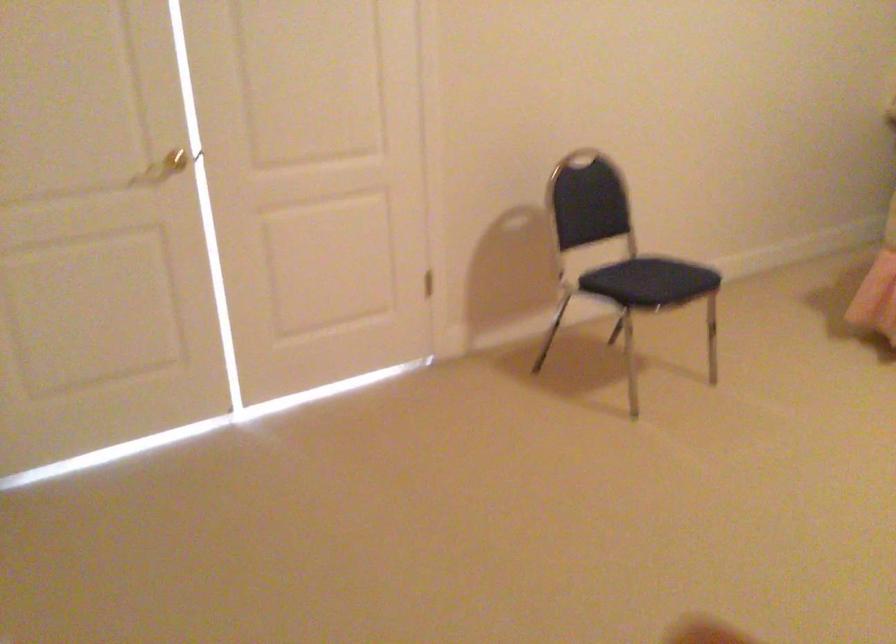
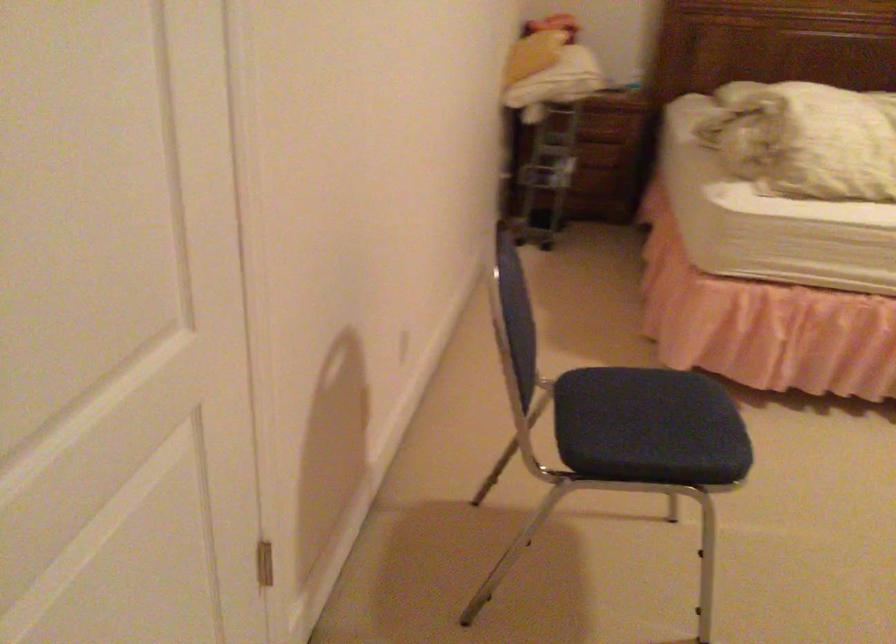
Find the pixel in the second image that matches (627,278) in the first image.

(650, 433)